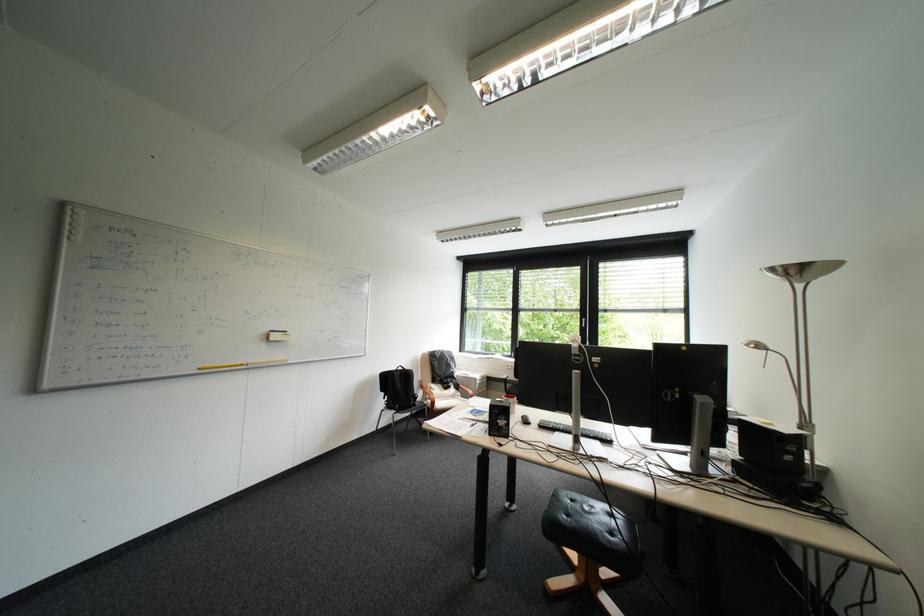
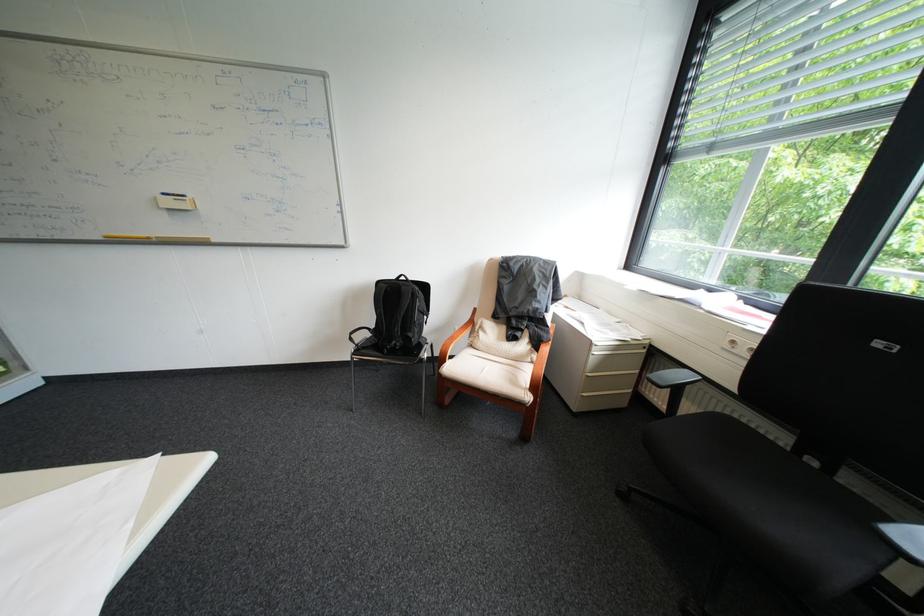
Locate, in the second image, the point that corresponds to (x=490, y=383) in the first image.

(609, 353)